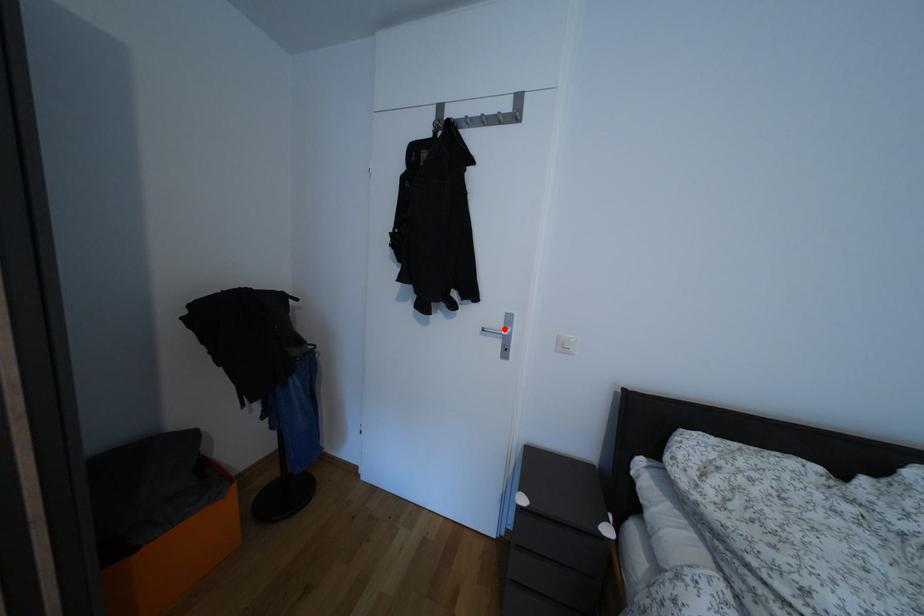
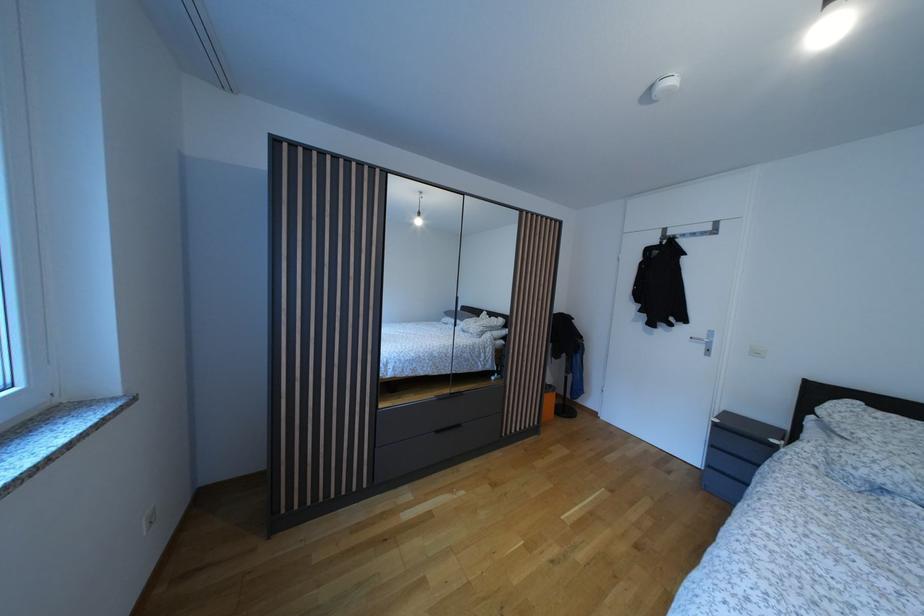
In the second image, find the point that corresponds to the highlighted location in the first image.

(709, 342)